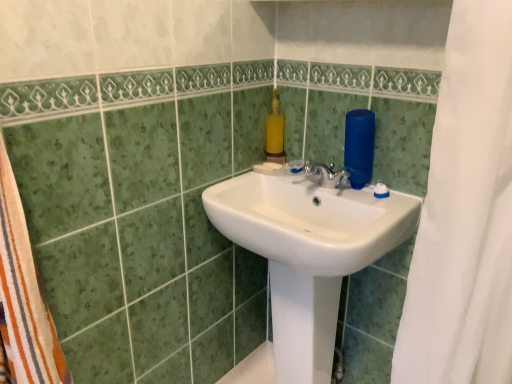
Describe the element at coordinates (275, 132) in the screenshot. I see `yellow matte soap dispenser at upper center` at that location.

Locate an element on the screen. The image size is (512, 384). yellow matte soap dispenser at upper center is located at coordinates (275, 132).

Describe the element at coordinates (308, 250) in the screenshot. I see `white glossy sink at center` at that location.

The height and width of the screenshot is (384, 512). Identify the location of white glossy sink at center. (308, 250).

Identify the location of yellow matte soap dispenser at upper center. (275, 132).

Considering the positions of objects yellow matte soap dispenser at upper center and white glossy sink at center in the image provided, who is more to the right, yellow matte soap dispenser at upper center or white glossy sink at center?

white glossy sink at center is more to the right.

Is yellow matte soap dispenser at upper center in front of or behind white glossy sink at center in the image?

In the image, yellow matte soap dispenser at upper center appears behind white glossy sink at center.

Which is in front, point (275, 156) or point (278, 311)?

The point (278, 311) is closer to the camera.

From the image's perspective, is yellow matte soap dispenser at upper center located beneath white glossy sink at center?

No, from the image's perspective, yellow matte soap dispenser at upper center is not below white glossy sink at center.

From a real-world perspective, between yellow matte soap dispenser at upper center and white glossy sink at center, who is vertically lower?

white glossy sink at center.

Which of these two, yellow matte soap dispenser at upper center or white glossy sink at center, is wider?

white glossy sink at center.

Considering the relative sizes of yellow matte soap dispenser at upper center and white glossy sink at center in the image provided, is yellow matte soap dispenser at upper center taller than white glossy sink at center?

In fact, yellow matte soap dispenser at upper center may be shorter than white glossy sink at center.

Can you confirm if yellow matte soap dispenser at upper center is smaller than white glossy sink at center?

Correct, yellow matte soap dispenser at upper center occupies less space than white glossy sink at center.

Would you say yellow matte soap dispenser at upper center is inside or outside white glossy sink at center?

yellow matte soap dispenser at upper center is not enclosed by white glossy sink at center.

Is yellow matte soap dispenser at upper center positioned far away from white glossy sink at center?

yellow matte soap dispenser at upper center is near white glossy sink at center, not far away.

Is white glossy sink at center at the back of yellow matte soap dispenser at upper center?

That's not correct — yellow matte soap dispenser at upper center is not looking away from white glossy sink at center.

How many degrees apart are the facing directions of yellow matte soap dispenser at upper center and white glossy sink at center?

3.48 degrees separate the facing orientations of yellow matte soap dispenser at upper center and white glossy sink at center.

At what (x,y) coordinates should I click in order to perform the action: click on soap dispenser behind the white glossy sink at center. Please return your answer as a coordinate pair (x, y). The width and height of the screenshot is (512, 384). Looking at the image, I should click on (275, 132).

Is white glossy sink at center to the right of yellow matte soap dispenser at upper center from the viewer's perspective?

Indeed, white glossy sink at center is positioned on the right side of yellow matte soap dispenser at upper center.

Is white glossy sink at center positioned in front of yellow matte soap dispenser at upper center?

Yes.

Which is less distant, (204, 195) or (272, 155)?

Point (204, 195) is positioned closer to the camera compared to point (272, 155).

In the scene shown: From the image's perspective, who appears lower, white glossy sink at center or yellow matte soap dispenser at upper center?

white glossy sink at center is shown below in the image.

From a real-world perspective, which is physically above, white glossy sink at center or yellow matte soap dispenser at upper center?

In real-world perspective, yellow matte soap dispenser at upper center is above.

Is white glossy sink at center wider than yellow matte soap dispenser at upper center?

Yes, white glossy sink at center is wider than yellow matte soap dispenser at upper center.

Which of these two, white glossy sink at center or yellow matte soap dispenser at upper center, stands taller?

With more height is white glossy sink at center.

Which of these two, white glossy sink at center or yellow matte soap dispenser at upper center, is smaller?

yellow matte soap dispenser at upper center is smaller.

Could yellow matte soap dispenser at upper center be considered to be inside white glossy sink at center?

No, yellow matte soap dispenser at upper center is not a part of white glossy sink at center.

Is white glossy sink at center beside yellow matte soap dispenser at upper center?

They are not placed beside each other.

Is white glossy sink at center turned away from yellow matte soap dispenser at upper center?

white glossy sink at center does not have its back to yellow matte soap dispenser at upper center.

What are the coordinates of `soap dispenser that is above the white glossy sink at center (from a real-world perspective)` in the screenshot? It's located at (275, 132).

Where is `soap dispenser above the white glossy sink at center (from a real-world perspective)`? This screenshot has height=384, width=512. soap dispenser above the white glossy sink at center (from a real-world perspective) is located at coordinates (275, 132).

Locate an element on the screen. soap dispenser on the left of white glossy sink at center is located at coordinates (275, 132).